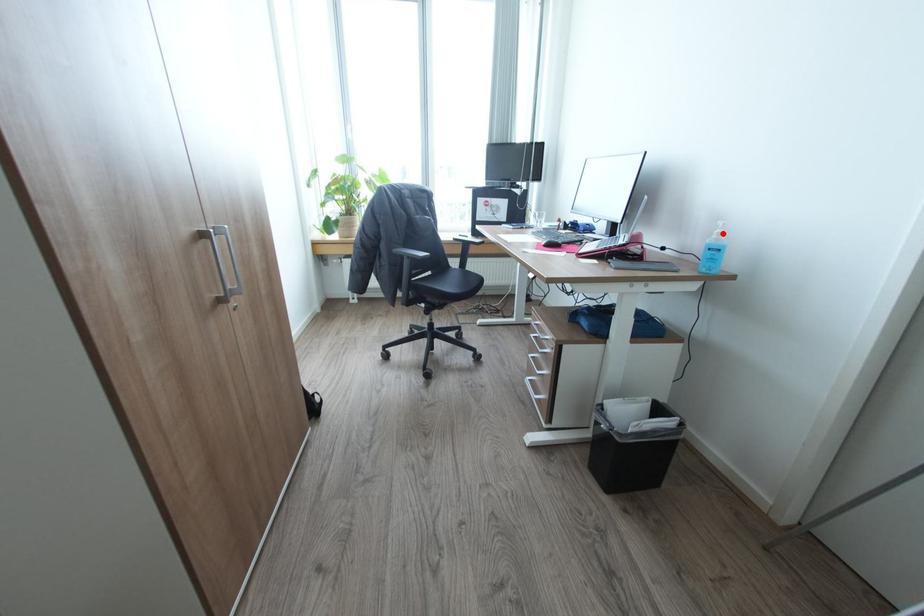
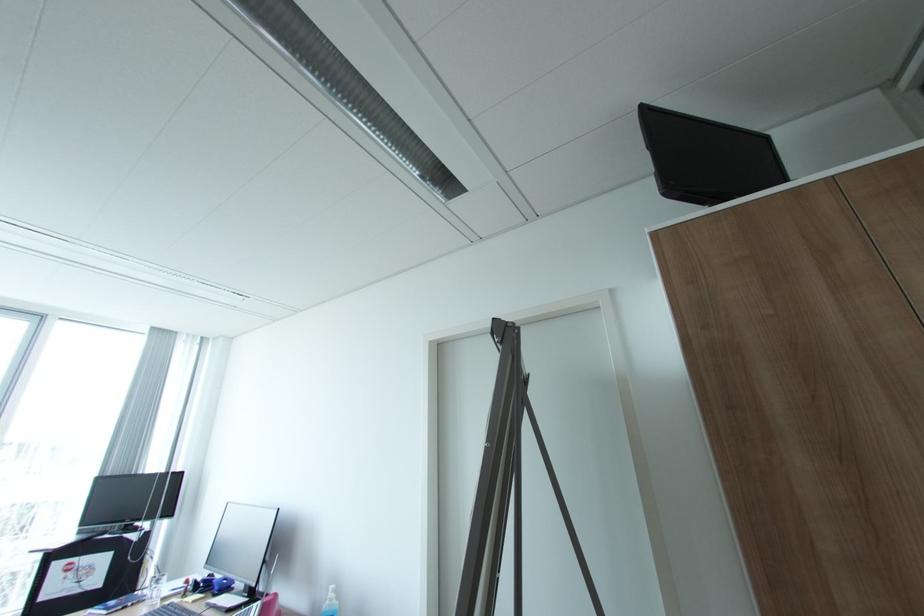
Where in the second image is the point corresponding to the highlighted location from the first image?

(336, 599)